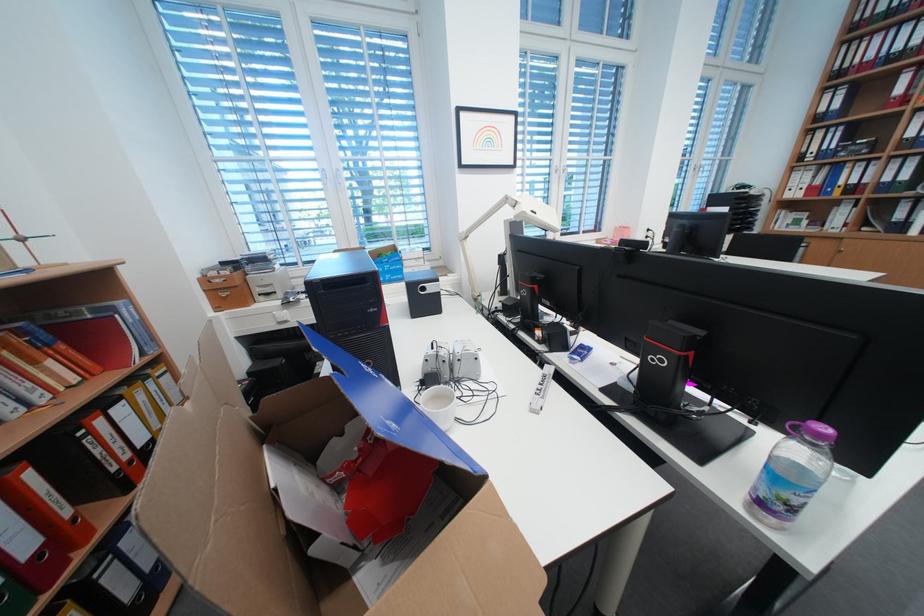
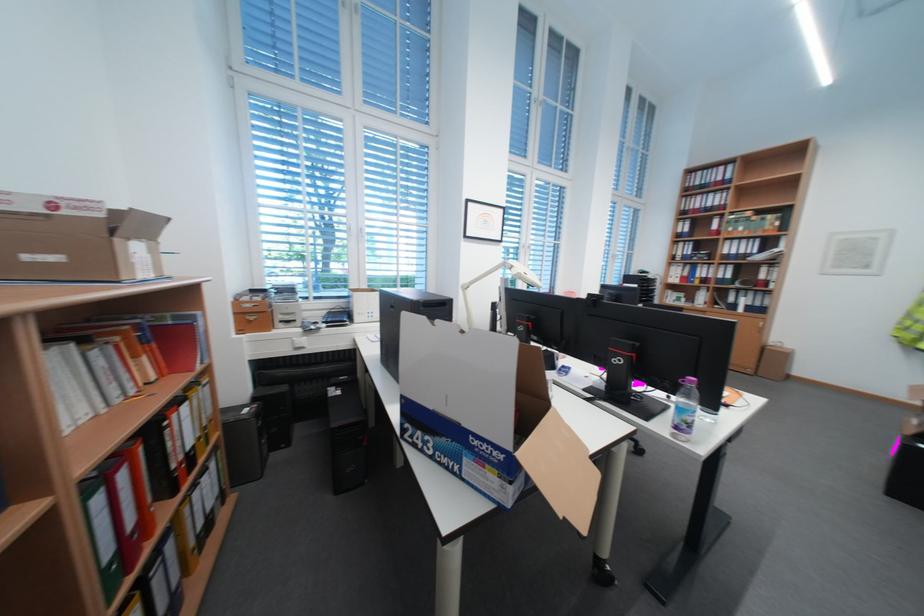
Find the pixel in the second image that matches the point at 530,204 in the first image.

(526, 268)